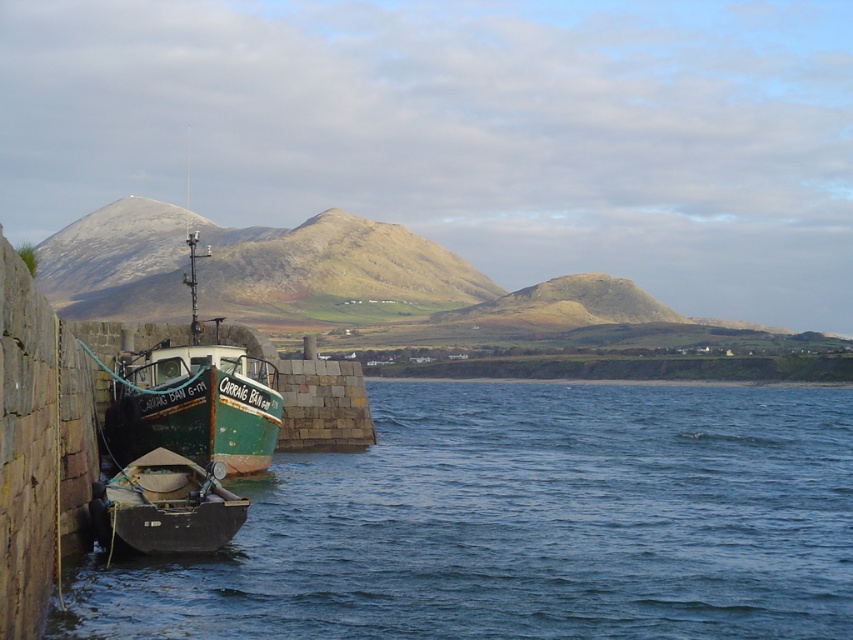
You are standing on the pier and see the blue water at lower left and the green matte boat at lower left. Which object is positioned more to the left side of the scene?

The green matte boat at lower left is positioned more to the left than the blue water at lower left because the blue water at lower left is to the right of the boat.

You are standing at the stone wall on the left side of the pier and want to walk towards the boat labeled CARRAIS BAIN. There are two points marked on the path ahead of you. The first point is at coordinate point (248, 570) and the second point is at coordinate point (213, 541). Which point should you reach first while walking towards the boat?

You should reach point (248, 570) first because it is in front of point (213, 541) along the path towards the boat.